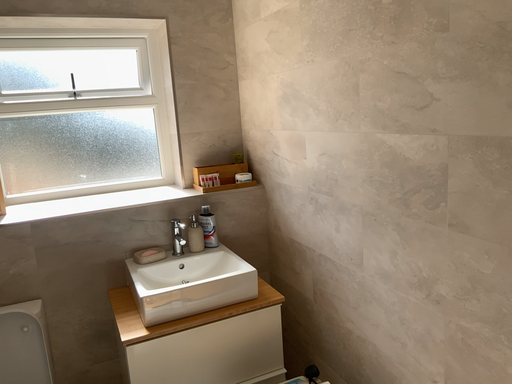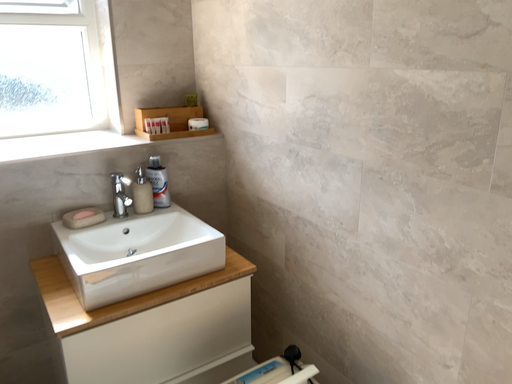
Question: Which way did the camera rotate in the video?

Choices:
 (A) rotated downward
 (B) rotated upward

Answer: (A)